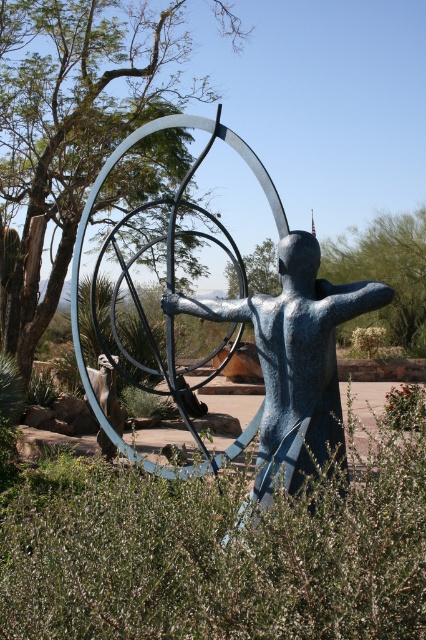
Between green leafy bush at center and green leafy tree at upper left, which one appears on the right side from the viewer's perspective?

green leafy bush at center is more to the right.

Which is in front, point (32, 528) or point (178, 17)?

Point (32, 528)

The width and height of the screenshot is (426, 640). What are the coordinates of `green leafy bush at center` in the screenshot? It's located at (218, 552).

Is green leafy bush at center taller than blue polished metal statue at center?

No, green leafy bush at center is not taller than blue polished metal statue at center.

Between green leafy bush at center and blue polished metal statue at center, which one has more height?

With more height is blue polished metal statue at center.

Does point (3, 586) come farther from viewer compared to point (319, 401)?

No, it is not.

Identify the location of green leafy bush at center. The width and height of the screenshot is (426, 640). (218, 552).

Is point (189, 42) positioned before point (417, 275)?

Yes, point (189, 42) is closer to viewer.

Locate an element on the screen. green leafy tree at upper left is located at coordinates (69, 131).